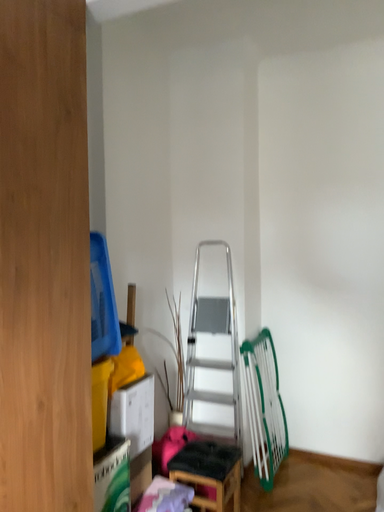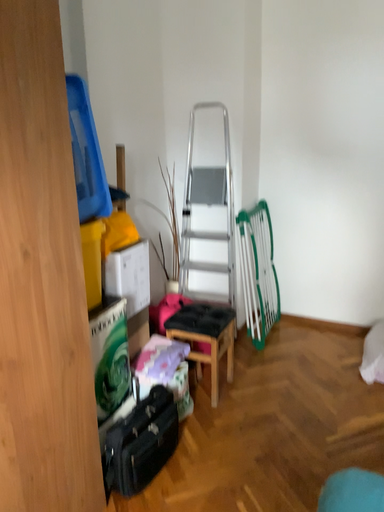
Question: Which way did the camera rotate in the video?

Choices:
 (A) rotated upward
 (B) rotated downward

Answer: (B)